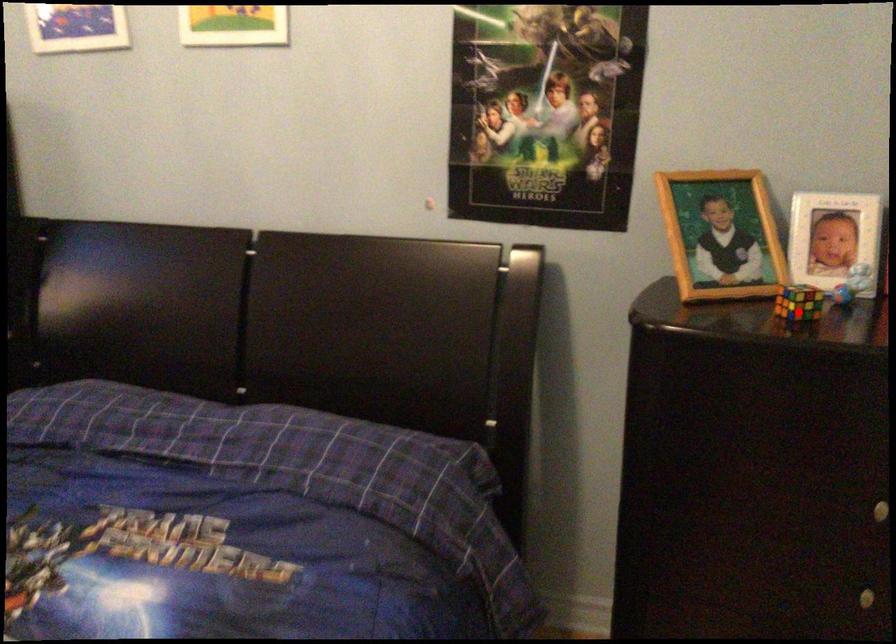
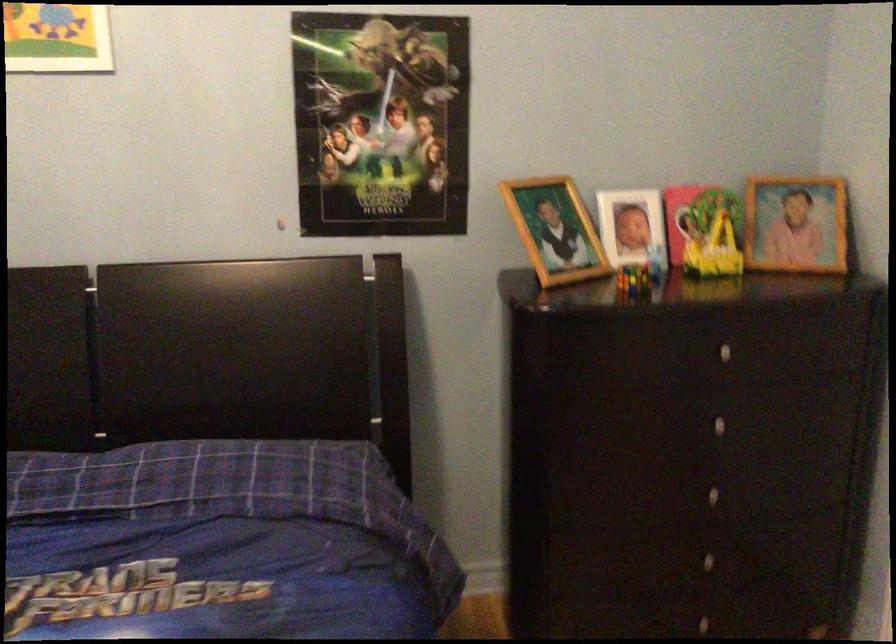
Find the pixel in the second image that matches the highlighted location in the first image.

(634, 279)